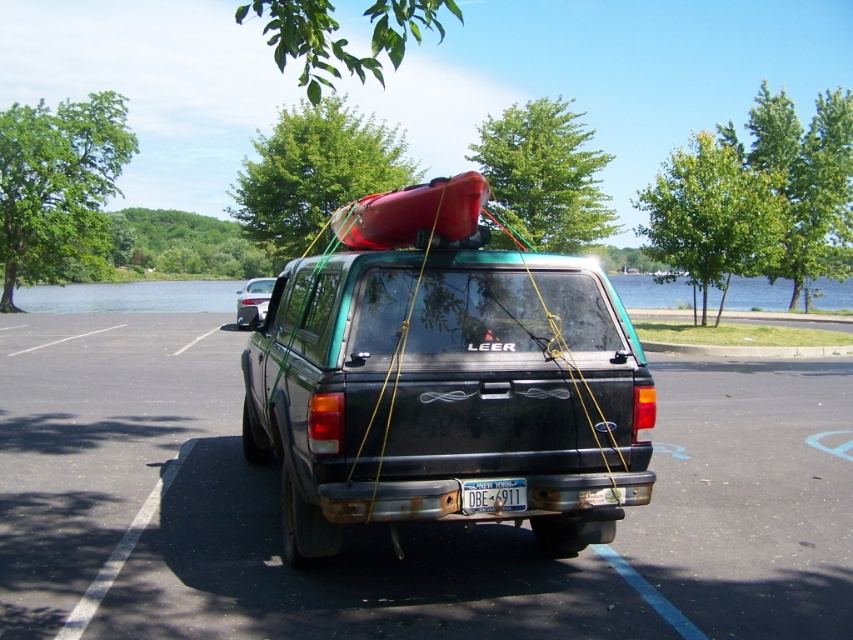
This screenshot has width=853, height=640. What are the coordinates of `matte black truck at center` in the screenshot? It's located at (445, 394).

Which of these two, matte black truck at center or satin silver sedan at rear, stands taller?

With more height is matte black truck at center.

The width and height of the screenshot is (853, 640). I want to click on matte black truck at center, so click(445, 394).

Who is positioned more to the left, black matte truck at center or white plastic license plate at center?

Positioned to the left is white plastic license plate at center.

Which is below, black matte truck at center or white plastic license plate at center?

black matte truck at center is lower down.

Describe the element at coordinates (229, 513) in the screenshot. I see `black matte truck at center` at that location.

Locate an element on the screen. Image resolution: width=853 pixels, height=640 pixels. black matte truck at center is located at coordinates (229, 513).

Can you confirm if matte black truck at center is smaller than white plastic license plate at center?

No, matte black truck at center is not smaller than white plastic license plate at center.

Who is lower down, matte black truck at center or white plastic license plate at center?

white plastic license plate at center is lower down.

The image size is (853, 640). I want to click on matte black truck at center, so click(445, 394).

Where is `matte black truck at center`? The height and width of the screenshot is (640, 853). matte black truck at center is located at coordinates (445, 394).